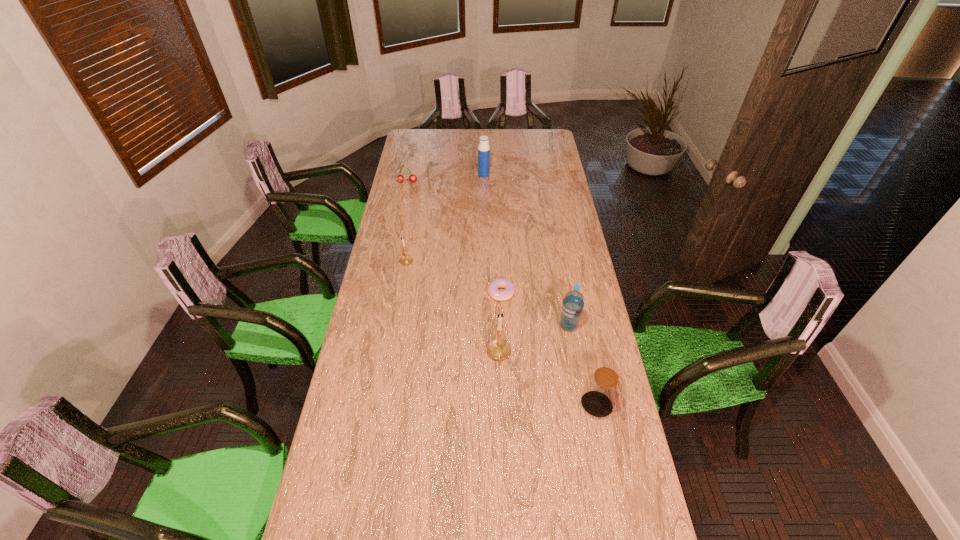
Locate an element on the screen. This screenshot has height=540, width=960. the third farthest object is located at coordinates (406, 259).

I want to click on the fifth tallest object, so click(x=406, y=259).

Locate an element on the screen. The height and width of the screenshot is (540, 960). the second nearest object is located at coordinates (499, 349).

Find the location of a particular element. This screenshot has height=540, width=960. the taller candle holder is located at coordinates (499, 349).

Find the location of a particular element. The image size is (960, 540). the left water bottle is located at coordinates (483, 149).

The width and height of the screenshot is (960, 540). Find the location of `the farther water bottle`. the farther water bottle is located at coordinates (483, 149).

This screenshot has width=960, height=540. Find the location of `the second shortest object`. the second shortest object is located at coordinates (400, 178).

This screenshot has height=540, width=960. Find the location of `the sixth nearest object`. the sixth nearest object is located at coordinates (400, 178).

Locate an element on the screen. the third nearest object is located at coordinates (572, 307).

Locate an element on the screen. The height and width of the screenshot is (540, 960). the right water bottle is located at coordinates (572, 307).